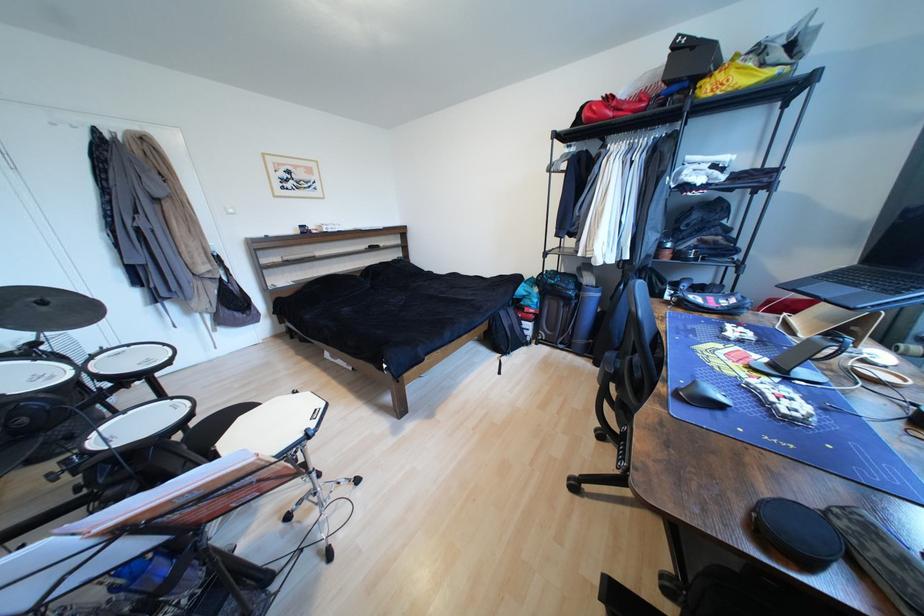
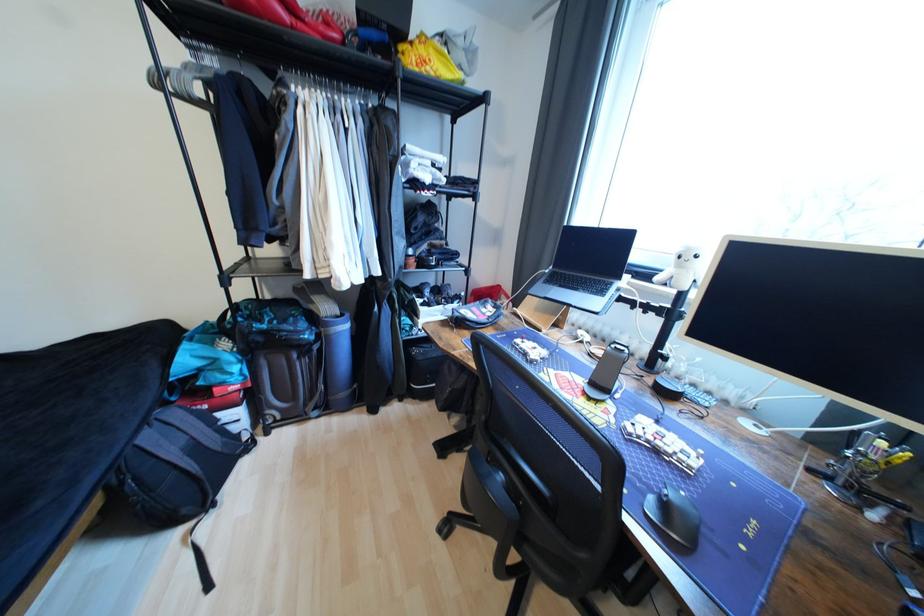
The point at [763,390] is marked in the first image. Where is the corresponding point in the second image?

(646, 438)